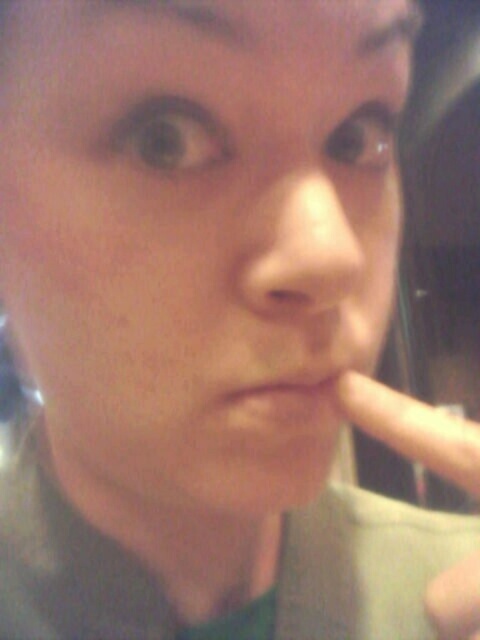
Question: Can you confirm if smooth skin nose at center is bigger than matte skin at center?

Choices:
 (A) yes
 (B) no

Answer: (A)

Question: Observing the image, what is the correct spatial positioning of smooth skin nose at center in reference to matte skin at center?

Choices:
 (A) above
 (B) below

Answer: (A)

Question: Is smooth skin nose at center thinner than matte skin at center?

Choices:
 (A) no
 (B) yes

Answer: (B)

Question: Which object appears closest to the camera in this image?

Choices:
 (A) smooth skin nose at center
 (B) matte skin at center

Answer: (A)